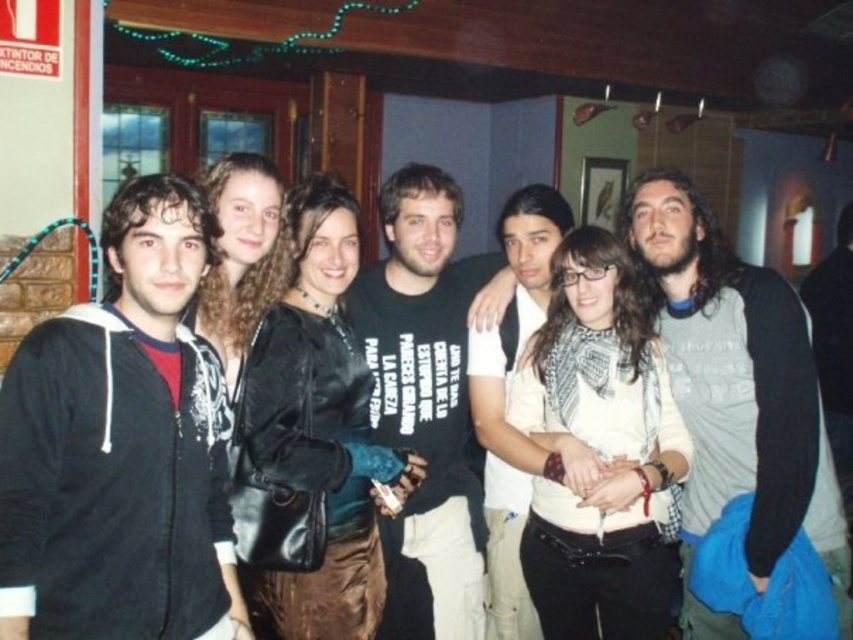
Question: Which of the following is the farthest from the observer?

Choices:
 (A) black cotton t-shirt at center
 (B) gray cotton t-shirt at center

Answer: (A)

Question: Estimate the real-world distances between objects in this image. Which object is closer to the black cotton t-shirt at center?

Choices:
 (A) gray cotton t-shirt at center
 (B) black hoodie at center

Answer: (A)

Question: From the image, what is the correct spatial relationship of black hoodie at center in relation to gray cotton t-shirt at center?

Choices:
 (A) right
 (B) left

Answer: (B)

Question: Is the position of black hoodie at center more distant than that of gray cotton t-shirt at center?

Choices:
 (A) yes
 (B) no

Answer: (B)

Question: Can you confirm if gray cotton t-shirt at center is positioned to the right of black cotton t-shirt at center?

Choices:
 (A) yes
 (B) no

Answer: (A)

Question: Which point is farther from the camera taking this photo?

Choices:
 (A) (444, 355)
 (B) (796, 365)
 (C) (207, 545)

Answer: (A)